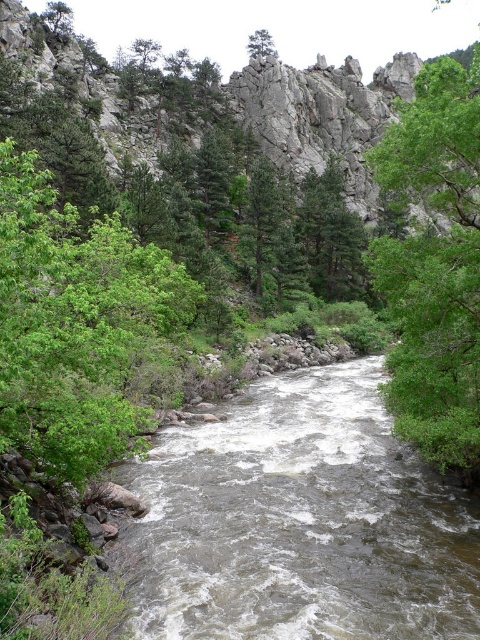
You are standing at the point with coordinates point (419, 605) and want to walk towards the point with coordinates point (17, 442). Which direction should you face to move towards your destination?

You should face towards the lower left direction to move from point (419, 605) to point (17, 442) since point (419, 605) is in front of point (17, 442).